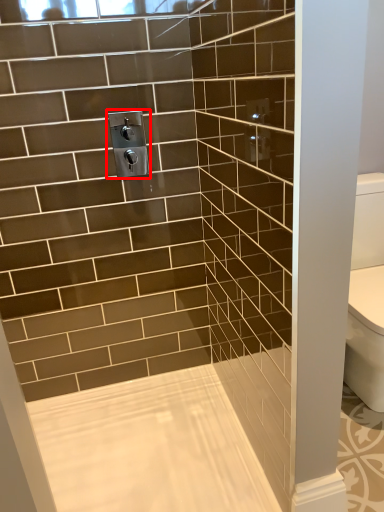
Question: Where is plumbing fixture (annotated by the red box) located in relation to bath in the image?

Choices:
 (A) right
 (B) left

Answer: (B)